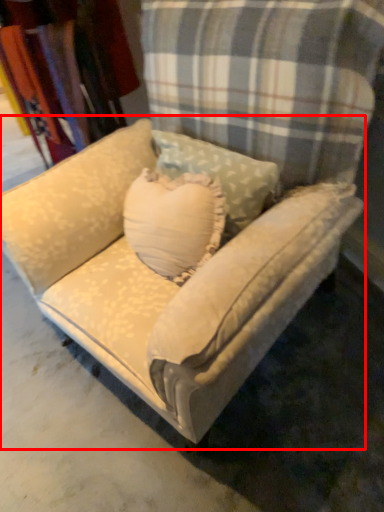
Question: From the image's perspective, considering the relative positions of studio couch (annotated by the red box) and fabric in the image provided, where is studio couch (annotated by the red box) located with respect to the staircase?

Choices:
 (A) above
 (B) below

Answer: (B)